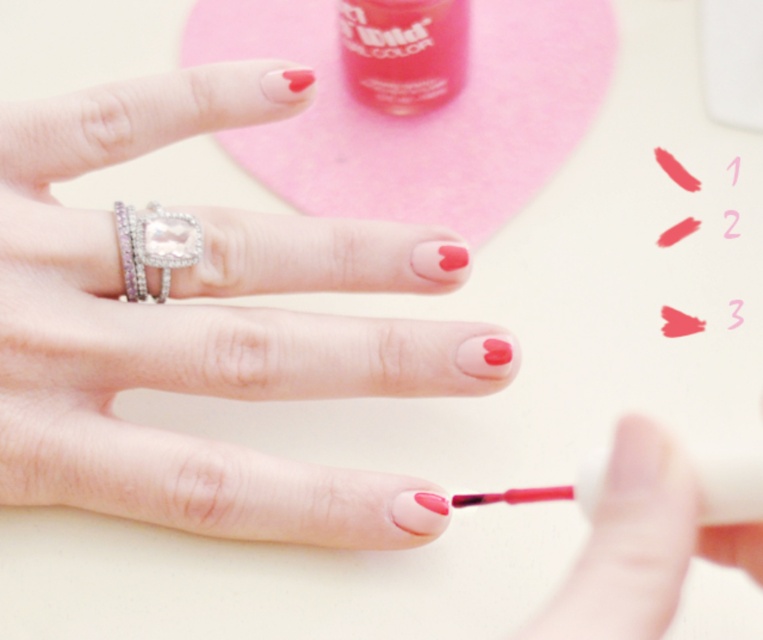
The height and width of the screenshot is (640, 763). I want to click on matte pink nail polish at center, so click(x=188, y=340).

Is point (127, 305) in front of point (543, 493)?

No.

Locate an element on the screen. matte pink nail polish at center is located at coordinates (188, 340).

Which is more to the left, matte pink nail polish at center or diamond ring at left?

diamond ring at left is more to the left.

Is point (330, 362) less distant than point (127, 289)?

That is False.

Where is `matte pink nail polish at center`? This screenshot has width=763, height=640. matte pink nail polish at center is located at coordinates (188, 340).

Who is more forward, (156,240) or (517,497)?

Positioned in front is point (517,497).

Looking at this image, can you confirm if diamond ring at left is shorter than matte pink lipstick at lower center?

In fact, diamond ring at left may be taller than matte pink lipstick at lower center.

Does point (139, 237) come in front of point (469, 497)?

No, (139, 237) is behind (469, 497).

I want to click on diamond ring at left, so click(153, 244).